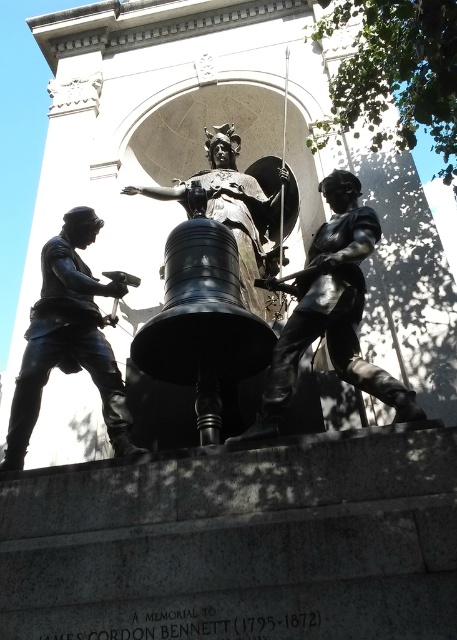
Which is more to the left, shiny bronze statue at center or bronze statue at center?

bronze statue at center

Is shiny bronze statue at center wider than bronze statue at center?

No.

Is point (347, 240) more distant than point (232, 198)?

No, (347, 240) is in front of (232, 198).

Locate an element on the screen. This screenshot has width=457, height=640. shiny bronze statue at center is located at coordinates (331, 312).

Who is more forward, (x=356, y=196) or (x=56, y=237)?

Point (x=56, y=237) is more forward.

Is point (331, 292) less distant than point (96, 333)?

Yes, it is in front of point (96, 333).

The height and width of the screenshot is (640, 457). Find the location of `shiny bronze statue at center`. shiny bronze statue at center is located at coordinates (331, 312).

Is bronze statue at left to the right of bronze statue at center from the viewer's perspective?

Incorrect, bronze statue at left is not on the right side of bronze statue at center.

Who is positioned more to the right, bronze statue at left or bronze statue at center?

Positioned to the right is bronze statue at center.

Is point (110, 349) less distant than point (259, 164)?

Yes, point (110, 349) is closer to viewer.

The width and height of the screenshot is (457, 640). I want to click on bronze statue at left, so click(69, 339).